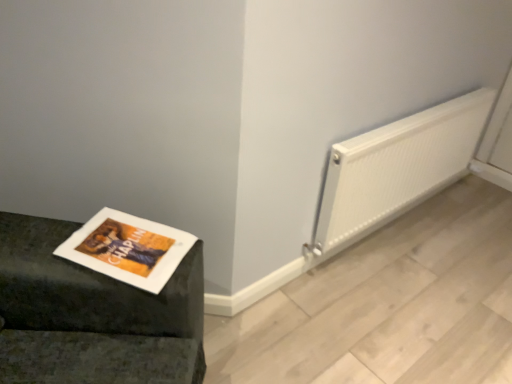
Locate an element on the screen. This screenshot has width=512, height=384. white ribbed radiator at right is located at coordinates coord(398,167).

This screenshot has height=384, width=512. Describe the element at coordinates (398, 167) in the screenshot. I see `white ribbed radiator at right` at that location.

Image resolution: width=512 pixels, height=384 pixels. What do you see at coordinates (128, 249) in the screenshot?
I see `matte paper magazine at lower left` at bounding box center [128, 249].

Measure the distance between point (95, 215) and camera.

A distance of 1.47 meters exists between point (95, 215) and camera.

What are the coordinates of `matte paper magazine at lower left` in the screenshot? It's located at (128, 249).

At what (x,y) coordinates should I click in order to perform the action: click on white ribbed radiator at right. Please return your answer as a coordinate pair (x, y). The image size is (512, 384). Looking at the image, I should click on (398, 167).

Which object is positioned more to the right, matte paper magazine at lower left or white ribbed radiator at right?

From the viewer's perspective, white ribbed radiator at right appears more on the right side.

Is matte paper magazine at lower left in front of or behind white ribbed radiator at right in the image?

In the image, matte paper magazine at lower left appears in front of white ribbed radiator at right.

Which is in front, point (115, 217) or point (415, 128)?

Point (115, 217)

From the image's perspective, is matte paper magazine at lower left positioned above or below white ribbed radiator at right?

Based on their image positions, matte paper magazine at lower left is located beneath white ribbed radiator at right.

From a real-world perspective, is matte paper magazine at lower left physically above white ribbed radiator at right?

Yes, from a real-world perspective, matte paper magazine at lower left is above white ribbed radiator at right.

Looking at their sizes, would you say matte paper magazine at lower left is wider or thinner than white ribbed radiator at right?

Clearly, matte paper magazine at lower left has more width compared to white ribbed radiator at right.

Is matte paper magazine at lower left shorter than white ribbed radiator at right?

Indeed, matte paper magazine at lower left has a lesser height compared to white ribbed radiator at right.

Does matte paper magazine at lower left have a larger size compared to white ribbed radiator at right?

No, matte paper magazine at lower left is not bigger than white ribbed radiator at right.

Is white ribbed radiator at right completely or partially inside matte paper magazine at lower left?

Actually, white ribbed radiator at right is outside matte paper magazine at lower left.

Are matte paper magazine at lower left and white ribbed radiator at right located far from each other?

Absolutely, matte paper magazine at lower left is distant from white ribbed radiator at right.

Is matte paper magazine at lower left facing towards white ribbed radiator at right?

No.

Can you tell me how much matte paper magazine at lower left and white ribbed radiator at right differ in facing direction?

31.3 degrees separate the facing orientations of matte paper magazine at lower left and white ribbed radiator at right.

What are the coordinates of `radiator located on the right of matte paper magazine at lower left` in the screenshot? It's located at click(x=398, y=167).

Between white ribbed radiator at right and matte paper magazine at lower left, which one appears on the left side from the viewer's perspective?

matte paper magazine at lower left.

Who is more distant, white ribbed radiator at right or matte paper magazine at lower left?

white ribbed radiator at right is further from the camera.

Considering the points (368, 224) and (162, 283), which point is in front, point (368, 224) or point (162, 283)?

The point (162, 283) is more forward.

From the image's perspective, is white ribbed radiator at right located above matte paper magazine at lower left?

Yes.

From a real-world perspective, is white ribbed radiator at right positioned above or below matte paper magazine at lower left?

From a real-world perspective, white ribbed radiator at right is physically below matte paper magazine at lower left.

Which object is wider, white ribbed radiator at right or matte paper magazine at lower left?

matte paper magazine at lower left is wider.

Is white ribbed radiator at right shorter than matte paper magazine at lower left?

Incorrect, the height of white ribbed radiator at right does not fall short of that of matte paper magazine at lower left.

Looking at this image, between white ribbed radiator at right and matte paper magazine at lower left, which one has smaller size?

matte paper magazine at lower left.

Is white ribbed radiator at right spatially inside matte paper magazine at lower left, or outside of it?

white ribbed radiator at right is spatially situated outside matte paper magazine at lower left.

Is white ribbed radiator at right positioned far away from matte paper magazine at lower left?

Yes, white ribbed radiator at right is far from matte paper magazine at lower left.

Is white ribbed radiator at right facing away from matte paper magazine at lower left?

No.

How many degrees apart are the facing directions of white ribbed radiator at right and matte paper magazine at lower left?

The angular difference between white ribbed radiator at right and matte paper magazine at lower left is 31.3 degrees.

How far apart are white ribbed radiator at right and matte paper magazine at lower left?

3.52 feet.

The height and width of the screenshot is (384, 512). Identify the location of magazine located below the white ribbed radiator at right (from the image's perspective). (x=128, y=249).

At what (x,y) coordinates should I click in order to perform the action: click on magazine above the white ribbed radiator at right (from a real-world perspective). Please return your answer as a coordinate pair (x, y). Looking at the image, I should click on (128, 249).

What are the coordinates of `magazine in front of the white ribbed radiator at right` in the screenshot? It's located at (128, 249).